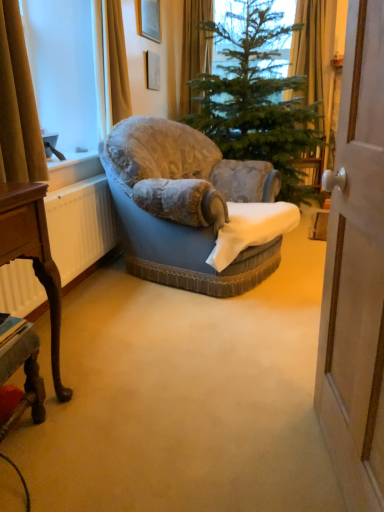
Question: Should I look upward or downward to see green textured christmas tree at center?

Choices:
 (A) down
 (B) up

Answer: (B)

Question: Is green textured christmas tree at center thinner than wooden polished desk at lower left, acting as the 2th desk starting from the bottom?

Choices:
 (A) yes
 (B) no

Answer: (B)

Question: Can you confirm if green textured christmas tree at center is smaller than wooden polished desk at lower left, acting as the 2th desk starting from the bottom?

Choices:
 (A) yes
 (B) no

Answer: (B)

Question: From the image's perspective, would you say green textured christmas tree at center is positioned over wooden polished desk at lower left, which is the 1th desk from top to bottom?

Choices:
 (A) yes
 (B) no

Answer: (A)

Question: From a real-world perspective, is green textured christmas tree at center located higher than wooden polished desk at lower left, which is the 1th desk from top to bottom?

Choices:
 (A) no
 (B) yes

Answer: (B)

Question: Is green textured christmas tree at center at the left side of wooden polished desk at lower left, which is the 1th desk from top to bottom?

Choices:
 (A) yes
 (B) no

Answer: (B)

Question: Considering the relative sizes of green textured christmas tree at center and wooden polished desk at lower left, which is the 1th desk from top to bottom, in the image provided, is green textured christmas tree at center wider than wooden polished desk at lower left, which is the 1th desk from top to bottom,?

Choices:
 (A) no
 (B) yes

Answer: (B)

Question: Is brown fabric curtain at left, the first curtain viewed from the front, smaller than velvet blue armchair at center?

Choices:
 (A) yes
 (B) no

Answer: (A)

Question: From the image's perspective, is brown fabric curtain at left, arranged as the first curtain when viewed from the left, on top of velvet blue armchair at center?

Choices:
 (A) no
 (B) yes

Answer: (B)

Question: Is brown fabric curtain at left, marked as the 2th curtain in a top-to-bottom arrangement, thinner than velvet blue armchair at center?

Choices:
 (A) no
 (B) yes

Answer: (B)

Question: From the image's perspective, is brown fabric curtain at left, arranged as the 2th curtain when viewed from the right, beneath velvet blue armchair at center?

Choices:
 (A) no
 (B) yes

Answer: (A)

Question: From a real-world perspective, is brown fabric curtain at left, the first curtain viewed from the front, located higher than velvet blue armchair at center?

Choices:
 (A) no
 (B) yes

Answer: (B)

Question: Is the surface of brown fabric curtain at left, the 2th curtain in the back-to-front sequence, in direct contact with velvet blue armchair at center?

Choices:
 (A) yes
 (B) no

Answer: (B)

Question: From the image's perspective, does velvet blue armchair at center appear higher than brown fabric curtain at left, the first curtain viewed from the front?

Choices:
 (A) no
 (B) yes

Answer: (A)